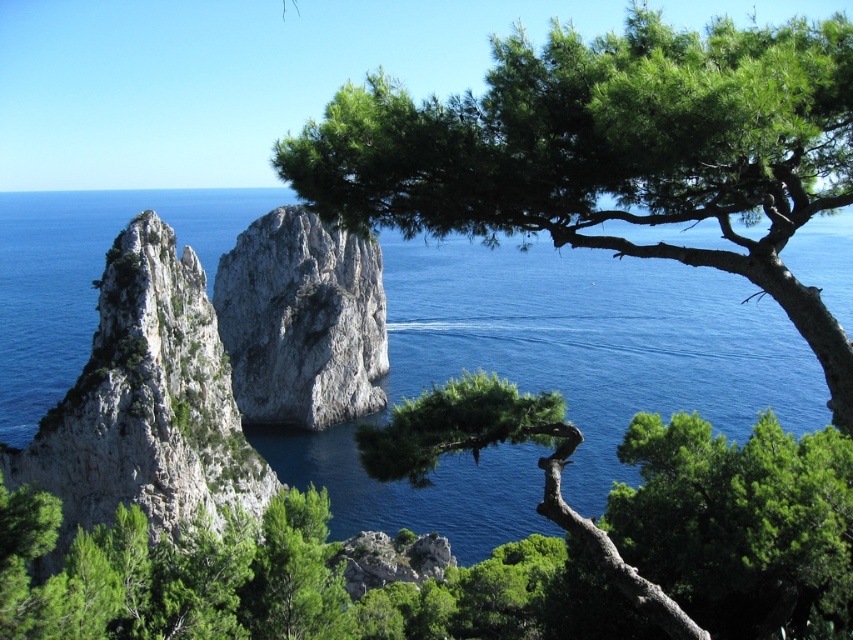
Which is below, white rocky cliff at left or white rocky cliff at center?

white rocky cliff at left

Who is more distant from viewer, (102, 493) or (305, 252)?

Positioned behind is point (305, 252).

Which is behind, point (180, 385) or point (257, 400)?

Point (257, 400)

In order to click on white rocky cliff at left in this screenshot , I will do `click(146, 403)`.